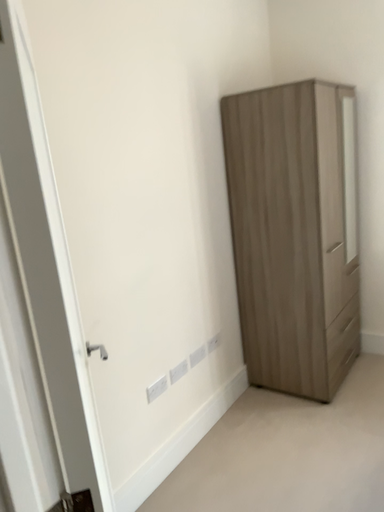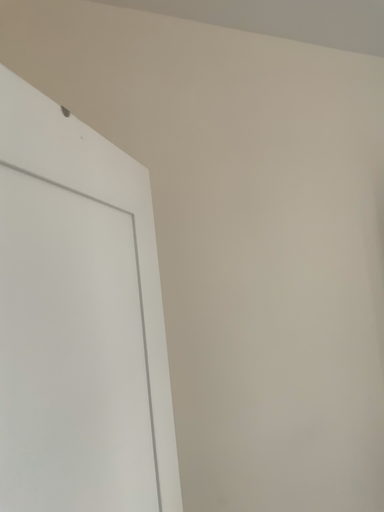
Question: How did the camera likely rotate when shooting the video?

Choices:
 (A) rotated right
 (B) rotated left

Answer: (B)